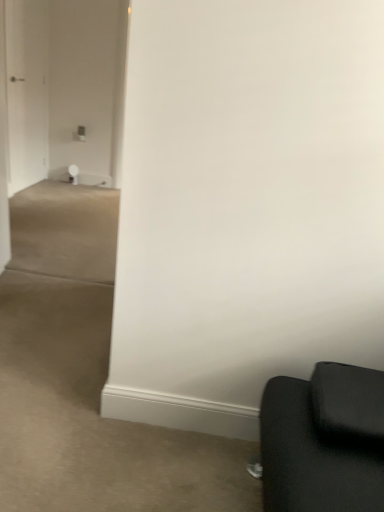
Question: Is the position of white glossy door at left less distant than that of white glossy door at upper left?

Choices:
 (A) no
 (B) yes

Answer: (B)

Question: Does white glossy door at left have a larger size compared to white glossy door at upper left?

Choices:
 (A) yes
 (B) no

Answer: (B)

Question: Does white glossy door at left appear on the left side of white glossy door at upper left?

Choices:
 (A) yes
 (B) no

Answer: (B)

Question: Does white glossy door at left lie behind white glossy door at upper left?

Choices:
 (A) no
 (B) yes

Answer: (A)

Question: Is white glossy door at upper left at the back of white glossy door at left?

Choices:
 (A) yes
 (B) no

Answer: (B)

Question: Is white glossy door at left in contact with white glossy door at upper left?

Choices:
 (A) no
 (B) yes

Answer: (A)

Question: Can you confirm if white glossy door at upper left is wider than white glossy door at left?

Choices:
 (A) yes
 (B) no

Answer: (B)

Question: Is white glossy door at upper left not close to white glossy door at left?

Choices:
 (A) yes
 (B) no

Answer: (B)

Question: Is white glossy door at upper left shorter than white glossy door at left?

Choices:
 (A) yes
 (B) no

Answer: (B)

Question: Does white glossy door at upper left turn towards white glossy door at left?

Choices:
 (A) no
 (B) yes

Answer: (A)

Question: From the image's perspective, would you say white glossy door at upper left is shown under white glossy door at left?

Choices:
 (A) no
 (B) yes

Answer: (A)

Question: Can you confirm if white glossy door at upper left is smaller than white glossy door at left?

Choices:
 (A) no
 (B) yes

Answer: (A)

Question: From the image's perspective, relative to white glossy door at upper left, is white glossy door at left above or below?

Choices:
 (A) above
 (B) below

Answer: (B)